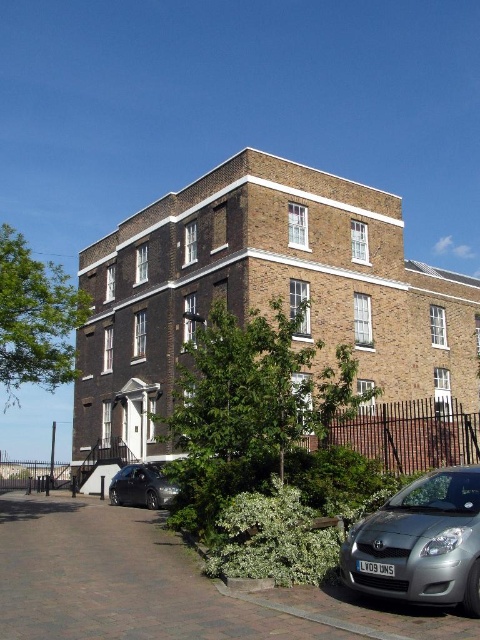
Question: Which of the following is the farthest from the observer?

Choices:
 (A) satin silver car at lower right
 (B) shiny black sedan at lower left

Answer: (B)

Question: Is satin silver car at lower right further to camera compared to shiny black sedan at lower left?

Choices:
 (A) yes
 (B) no

Answer: (B)

Question: Is the position of satin silver car at lower right more distant than that of shiny black sedan at lower left?

Choices:
 (A) no
 (B) yes

Answer: (A)

Question: Where is satin silver car at lower right located in relation to shiny black sedan at lower left in the image?

Choices:
 (A) right
 (B) left

Answer: (A)

Question: Which of the following is the closest to the observer?

Choices:
 (A) shiny black sedan at lower left
 (B) satin silver car at lower right

Answer: (B)

Question: Among these points, which one is farthest from the camera?

Choices:
 (A) (156, 486)
 (B) (447, 538)

Answer: (A)